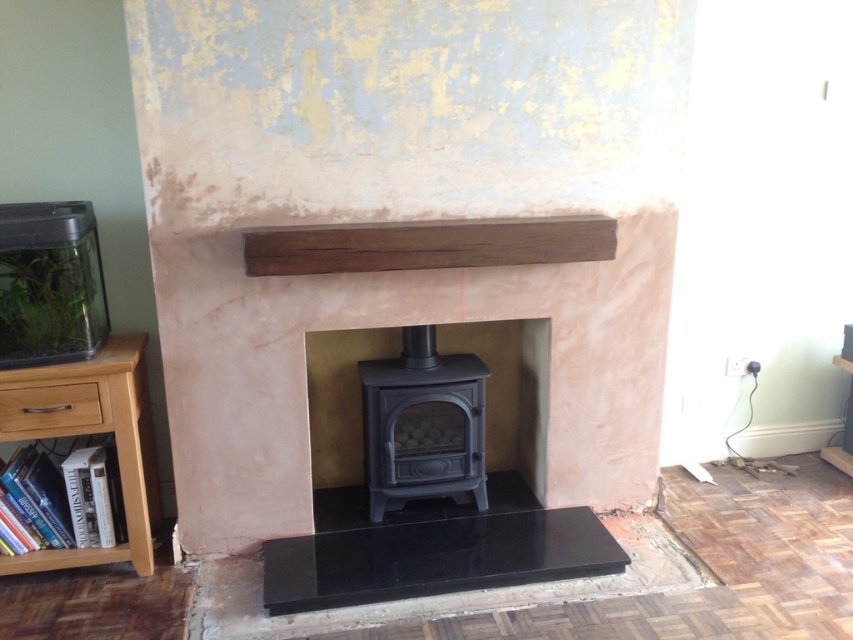
Question: Considering the relative positions of matte black stove at center and light wood/bookshelf at lower left in the image provided, where is matte black stove at center located with respect to light wood/bookshelf at lower left?

Choices:
 (A) below
 (B) above

Answer: (B)

Question: Which point is closer to the camera?

Choices:
 (A) click(x=141, y=468)
 (B) click(x=519, y=410)

Answer: (A)

Question: Is matte black stove at center smaller than light wood/bookshelf at lower left?

Choices:
 (A) no
 (B) yes

Answer: (A)

Question: Is matte black stove at center thinner than light wood/bookshelf at lower left?

Choices:
 (A) yes
 (B) no

Answer: (B)

Question: Which object appears closest to the camera in this image?

Choices:
 (A) light wood/bookshelf at lower left
 (B) matte black stove at center

Answer: (A)